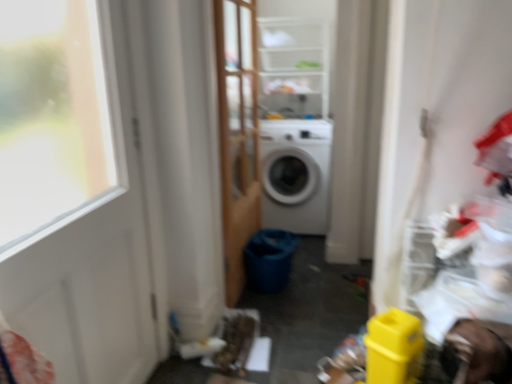
The image size is (512, 384). Find the location of `unoccupied region to the right of wooden screen door at center`. unoccupied region to the right of wooden screen door at center is located at coordinates (322, 283).